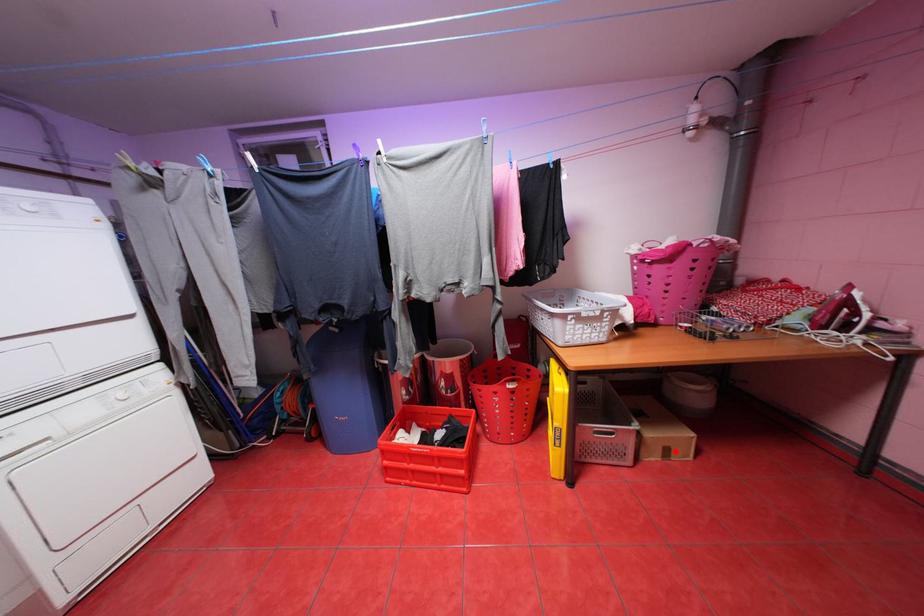
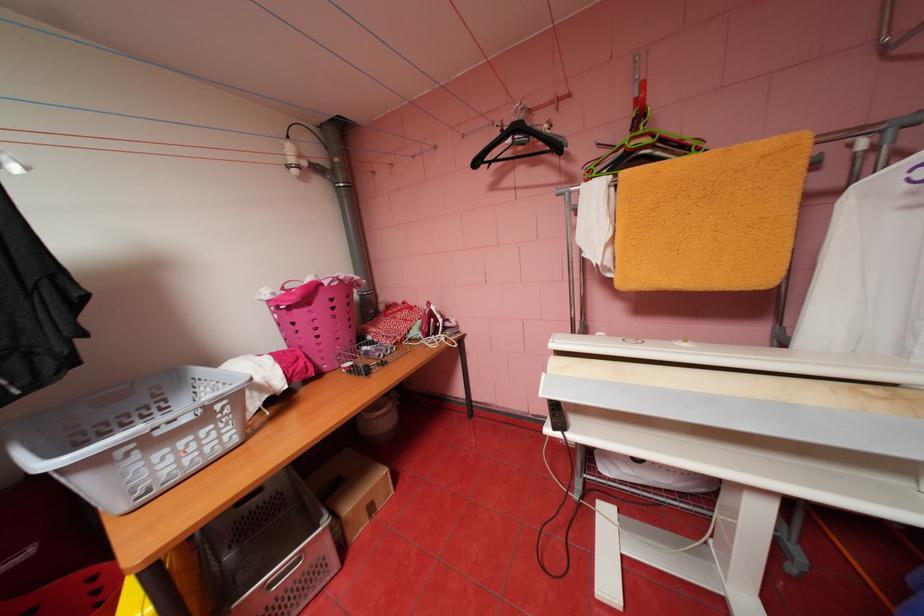
In the second image, find the point that corresponds to the highlighted location in the first image.

(380, 508)